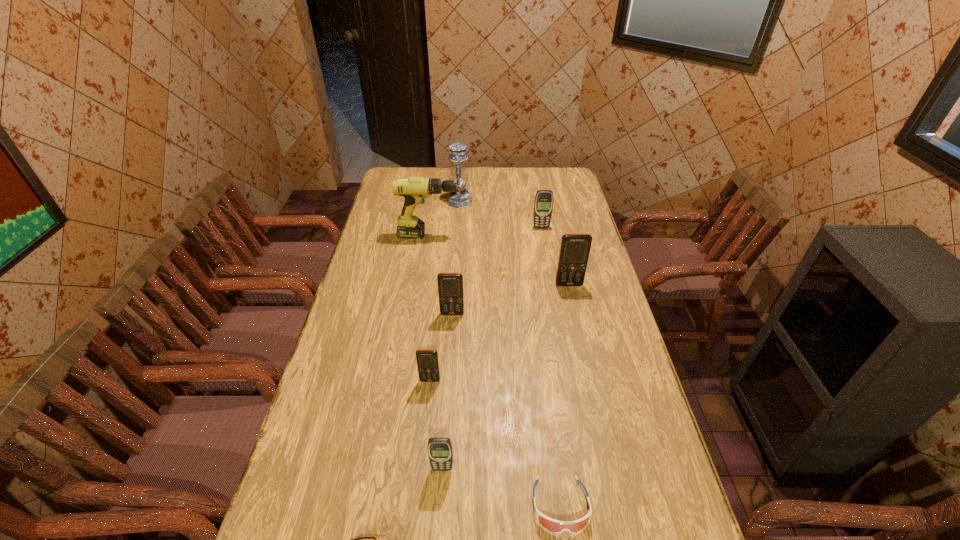
The height and width of the screenshot is (540, 960). Find the location of `vacant space located 0.100m on the screen of the left gray cellular telephone`. vacant space located 0.100m on the screen of the left gray cellular telephone is located at coordinates (440, 514).

Locate an element on the screen. This screenshot has height=540, width=960. object that is at the left edge is located at coordinates (414, 189).

At what (x,y) coordinates should I click in order to perform the action: click on object that is at the right edge. Please return your answer as a coordinate pair (x, y). The image size is (960, 540). Looking at the image, I should click on (574, 251).

In the image, there is a desktop. What are the coordinates of `free space at the far edge` in the screenshot? It's located at (519, 188).

In the image, there is a desktop. Where is `free space at the left edge`? The width and height of the screenshot is (960, 540). free space at the left edge is located at coordinates (356, 304).

You are a GUI agent. You are given a task and a screenshot of the screen. Output one action in this format:
    pyautogui.click(x=<x>, y=<y>)
    Task: Click on the blank space at the right edge of the desktop
    Image resolution: width=960 pixels, height=540 pixels.
    Given the screenshot: What is the action you would take?
    pyautogui.click(x=565, y=220)

This screenshot has height=540, width=960. I want to click on vacant space at the far left corner, so click(x=386, y=188).

You are a GUI agent. You are given a task and a screenshot of the screen. Output one action in this format:
    pyautogui.click(x=<x>, y=<y>)
    Task: Click on the vacant area at the far right corner of the desktop
    The image size is (960, 540).
    Given the screenshot: What is the action you would take?
    pyautogui.click(x=547, y=185)

In order to click on free space that is in between the lantern and the second farthest object in this screenshot , I will do `click(500, 214)`.

What are the coordinates of `vacant point located between the nearest orange cellular telephone and the third nearest cellular telephone` in the screenshot? It's located at (442, 347).